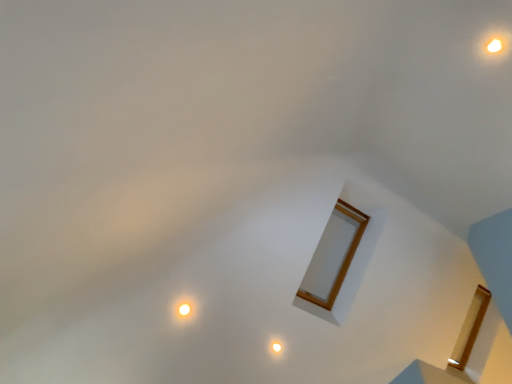
This screenshot has width=512, height=384. Describe the element at coordinates (276, 347) in the screenshot. I see `matte white light at center` at that location.

Find the location of `matte white light at center`. matte white light at center is located at coordinates (276, 347).

Find the location of `matte white light at lower left`. matte white light at lower left is located at coordinates (185, 309).

What do you see at coordinates (185, 309) in the screenshot? I see `matte white light at lower left` at bounding box center [185, 309].

Measure the distance between matte white light at lower left and camera.

The distance of matte white light at lower left from camera is 11.82 feet.

You are a GUI agent. You are given a task and a screenshot of the screen. Output one action in this format:
    pyautogui.click(x=<x>, y=<y>)
    Task: Click on the matte white light at center
    The width and height of the screenshot is (512, 384).
    Given the screenshot: What is the action you would take?
    pyautogui.click(x=276, y=347)

Between matte white light at center and matte white light at lower left, which one appears on the left side from the viewer's perspective?

matte white light at lower left is more to the left.

Between matte white light at center and matte white light at lower left, which one is positioned behind?

matte white light at center is further away from the camera.

Is point (275, 343) positioned behind point (177, 310)?

That is True.

From the image's perspective, relative to matte white light at lower left, is matte white light at center above or below?

Clearly, from the image's perspective, matte white light at center is below matte white light at lower left.

From a real-world perspective, is matte white light at center positioned under matte white light at lower left based on gravity?

Correct, in the physical world, matte white light at center is lower than matte white light at lower left.

Is matte white light at center wider or thinner than matte white light at lower left?

In the image, matte white light at center appears to be more narrow than matte white light at lower left.

Does matte white light at center have a lesser height compared to matte white light at lower left?

Yes.

Which of these two, matte white light at center or matte white light at lower left, is bigger?

matte white light at lower left.

Is matte white light at lower left completely or partially inside matte white light at center?

No, matte white light at center does not contain matte white light at lower left.

Is there a large distance between matte white light at center and matte white light at lower left?

No, there isn't a large distance between matte white light at center and matte white light at lower left.

Could you tell me if matte white light at center is turned towards matte white light at lower left?

No, matte white light at center is not facing towards matte white light at lower left.

Can you tell me how much matte white light at center and matte white light at lower left differ in facing direction?

0.00229 degrees separate the facing orientations of matte white light at center and matte white light at lower left.

I want to click on light behind the matte white light at lower left, so click(276, 347).

Which object is positioned more to the right, matte white light at lower left or matte white light at center?

matte white light at center is more to the right.

Does matte white light at lower left lie behind matte white light at center?

No, matte white light at lower left is closer to the camera.

Is point (187, 301) less distant than point (272, 349)?

Yes, point (187, 301) is in front of point (272, 349).

From the image's perspective, is matte white light at lower left over matte white light at center?

Correct, matte white light at lower left appears higher than matte white light at center in the image.

From a real-world perspective, which object rests below the other?

matte white light at center is physically lower.

Looking at their sizes, would you say matte white light at lower left is wider or thinner than matte white light at center?

Clearly, matte white light at lower left has more width compared to matte white light at center.

In the scene shown: Which of these two, matte white light at lower left or matte white light at center, stands shorter?

matte white light at center.

Who is smaller, matte white light at lower left or matte white light at center?

matte white light at center is smaller.

Which is correct: matte white light at lower left is inside matte white light at center, or outside of it?

matte white light at lower left cannot be found inside matte white light at center.

Is matte white light at lower left far away from matte white light at center?

matte white light at lower left is near matte white light at center, not far away.

Is matte white light at lower left positioned with its back to matte white light at center?

That's not correct — matte white light at lower left is not looking away from matte white light at center.

How different are the orientations of matte white light at lower left and matte white light at center in degrees?

The angular difference between matte white light at lower left and matte white light at center is 0.00229 degrees.

In the image, there is a matte white light at center. What are the coordinates of `glow above it (from the image's perspective)` in the screenshot? It's located at (185, 309).

At what (x,y) coordinates should I click in order to perform the action: click on light behind the matte white light at lower left. Please return your answer as a coordinate pair (x, y). The width and height of the screenshot is (512, 384). Looking at the image, I should click on (276, 347).

Locate an element on the screen. The width and height of the screenshot is (512, 384). glow above the matte white light at center (from the image's perspective) is located at coordinates (185, 309).